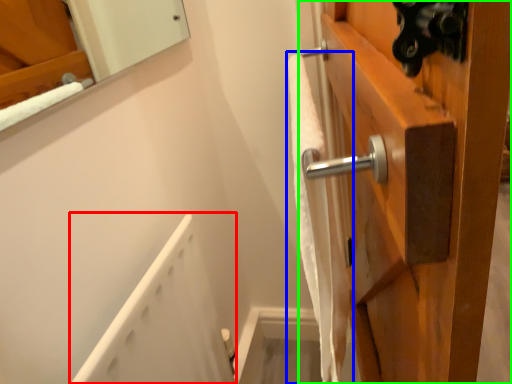
Question: Considering the real-world distances, which object is closest to bath (highlighted by a red box)? bath towel (highlighted by a blue box) or door (highlighted by a green box).

Choices:
 (A) bath towel
 (B) door

Answer: (A)